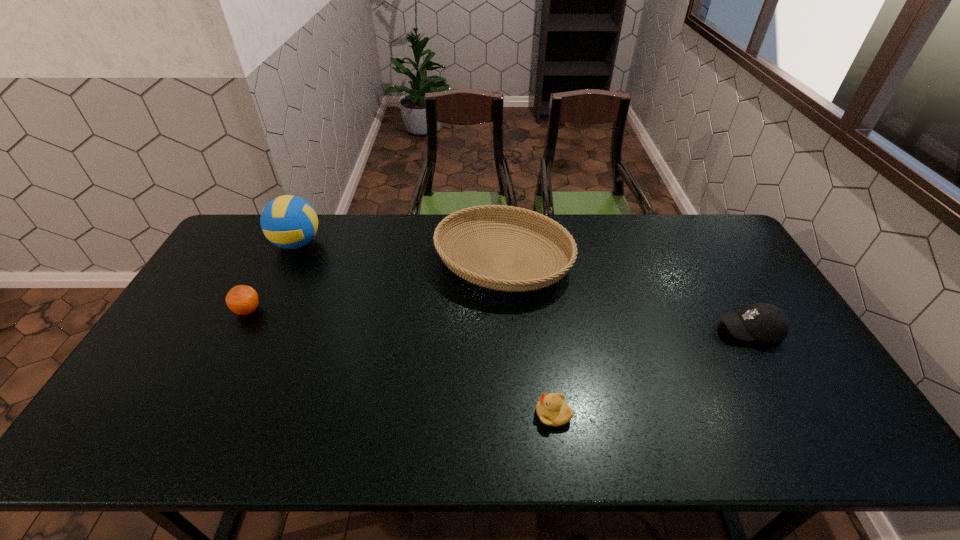
You are a GUI agent. You are given a task and a screenshot of the screen. Output one action in this format:
    pyautogui.click(x=<x>, y=<y>)
    Task: Click on the object located in the right edge section of the desktop
    This screenshot has width=960, height=540.
    Given the screenshot: What is the action you would take?
    pyautogui.click(x=765, y=322)

The height and width of the screenshot is (540, 960). Identify the location of object that is at the far left corner. (290, 222).

In the image, there is a desktop. What are the coordinates of `vacant space at the far edge` in the screenshot? It's located at pos(590,241).

Locate an element on the screen. This screenshot has height=540, width=960. vacant area at the near edge of the desktop is located at coordinates (278, 432).

The image size is (960, 540). Identify the location of vacant space at the left edge of the desktop. (224, 328).

I want to click on free space at the near right corner of the desktop, so click(824, 447).

The width and height of the screenshot is (960, 540). Identify the location of blank region between the basket and the orange. (375, 286).

Where is `vacant area that lies between the tallest object and the basket`? This screenshot has width=960, height=540. vacant area that lies between the tallest object and the basket is located at coordinates click(x=400, y=252).

Image resolution: width=960 pixels, height=540 pixels. Identify the location of free space that is in between the volleyball and the orange. pos(273,277).

I want to click on unoccupied area between the basket and the baseball cap, so click(x=626, y=296).